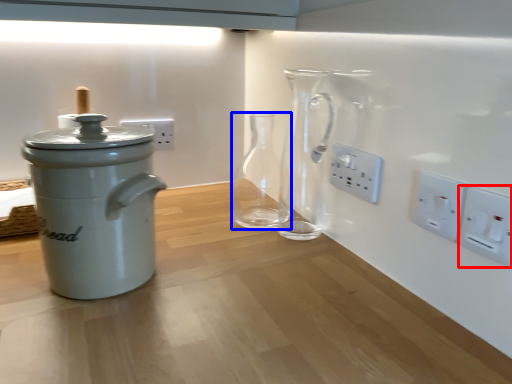
Question: Among these objects, which one is nearest to the camera, electric outlet (highlighted by a red box) or glass vase (highlighted by a blue box)?

Choices:
 (A) electric outlet
 (B) glass vase

Answer: (A)